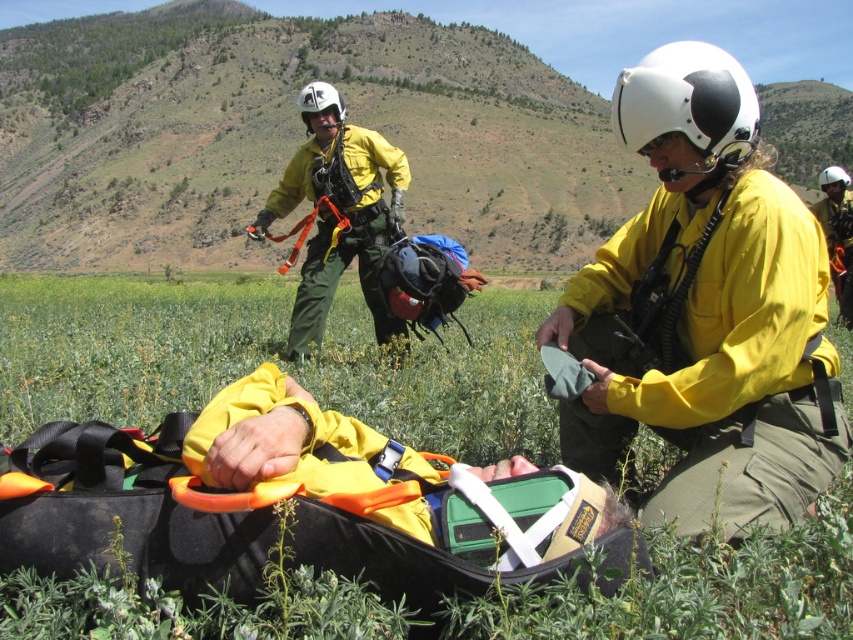
Based on the photo, how distant is yellow matte helmet at center from yellow matte helmet at upper center?

yellow matte helmet at center is 5.28 meters away from yellow matte helmet at upper center.

Which of these two, yellow matte helmet at center or yellow matte helmet at upper center, stands shorter?

yellow matte helmet at center is shorter.

Does point (701, 298) come farther from viewer compared to point (314, 237)?

No, (701, 298) is in front of (314, 237).

This screenshot has width=853, height=640. I want to click on yellow matte helmet at center, so click(x=706, y=310).

Can you confirm if green grassy at lower center is positioned below yellow matte helmet at center?

Incorrect, green grassy at lower center is not positioned below yellow matte helmet at center.

Who is lower down, green grassy at lower center or yellow matte helmet at center?

yellow matte helmet at center is below.

Who is more distant from viewer, (154,324) or (730,250)?

The point (154,324) is more distant.

Locate an element on the screen. green grassy at lower center is located at coordinates (126, 346).

Who is taller, green grassy at lower center or yellow matte helmet at upper center?

With more height is yellow matte helmet at upper center.

Which is below, green grassy at lower center or yellow matte helmet at upper center?

green grassy at lower center is lower down.

Locate an element on the screen. green grassy at lower center is located at coordinates (126, 346).

Locate an element on the screen. This screenshot has width=853, height=640. green grassy at lower center is located at coordinates [x=126, y=346].